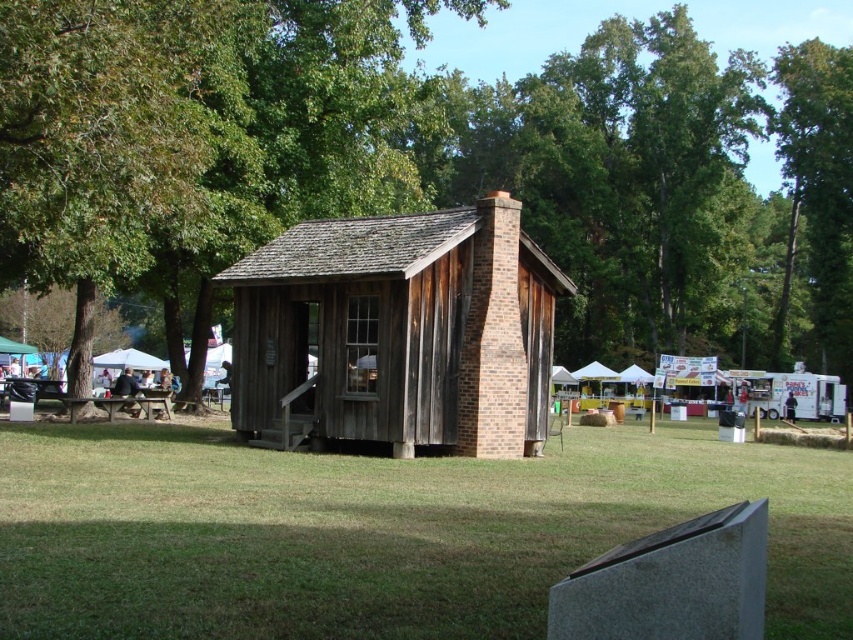
Is point (575, 109) positioned before point (850, 346)?

That is False.

Between point (88, 232) and point (846, 371), which one is positioned in front?

Point (88, 232) is more forward.

Where is `green leafy tree at center`? The width and height of the screenshot is (853, 640). green leafy tree at center is located at coordinates (430, 160).

Is green leafy tree at center taller than brown wooden picnic table at lower left?

Yes, green leafy tree at center is taller than brown wooden picnic table at lower left.

Is point (560, 113) positioned in front of point (115, 397)?

No, (560, 113) is behind (115, 397).

Identify the location of green leafy tree at center. (430, 160).

Which is more to the left, green grass at center or wooden cabin at center?

Positioned to the left is wooden cabin at center.

In the scene shown: Who is taller, green grass at center or wooden cabin at center?

Standing taller between the two is wooden cabin at center.

Between point (120, 472) and point (320, 330), which one is positioned in front?

Point (120, 472) is more forward.

This screenshot has height=640, width=853. I want to click on green grass at center, so click(380, 531).